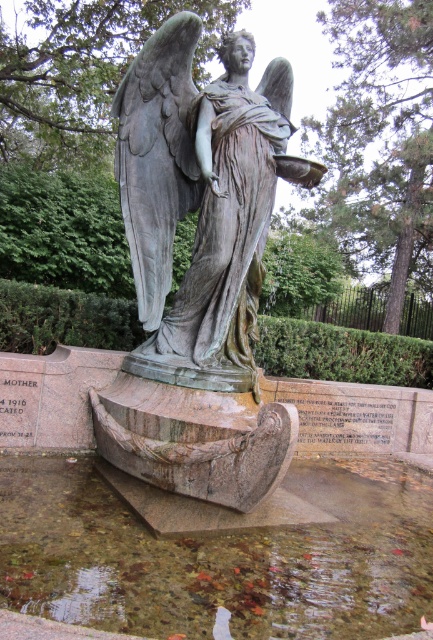
Question: Which of the following is the farthest from the observer?

Choices:
 (A) clear glass water at center
 (B) bronze statue at center

Answer: (B)

Question: Can you confirm if clear glass water at center is positioned to the right of bronze statue at center?

Choices:
 (A) yes
 (B) no

Answer: (A)

Question: Can you confirm if clear glass water at center is smaller than bronze statue at center?

Choices:
 (A) yes
 (B) no

Answer: (A)

Question: Where is clear glass water at center located in relation to bronze statue at center in the image?

Choices:
 (A) left
 (B) right

Answer: (B)